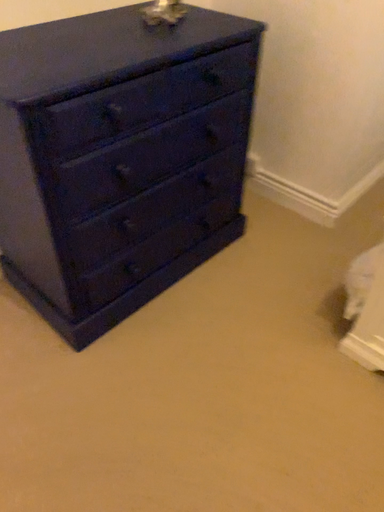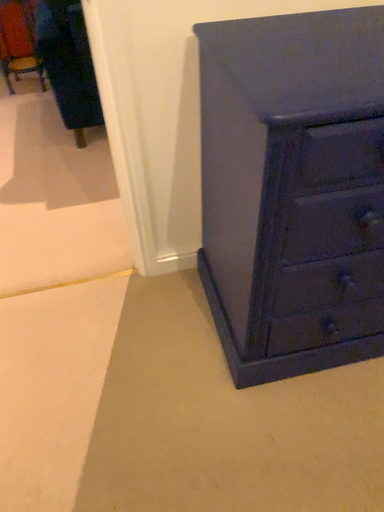
Question: Which way did the camera rotate in the video?

Choices:
 (A) rotated left
 (B) rotated right

Answer: (A)